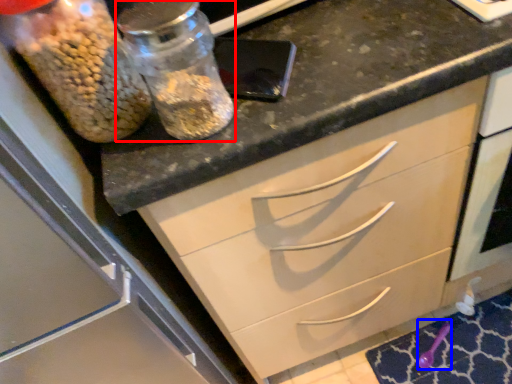
Question: Which object appears farthest to the camera in this image, glass jar (highlighted by a red box) or utensil (highlighted by a blue box)?

Choices:
 (A) glass jar
 (B) utensil

Answer: (B)